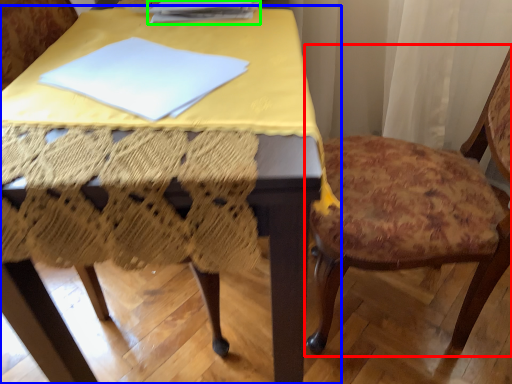
Question: Estimate the real-world distances between objects in this image. Which object is farther from chair (highlighted by a red box), table (highlighted by a blue box) or paperback book (highlighted by a green box)?

Choices:
 (A) table
 (B) paperback book

Answer: (B)